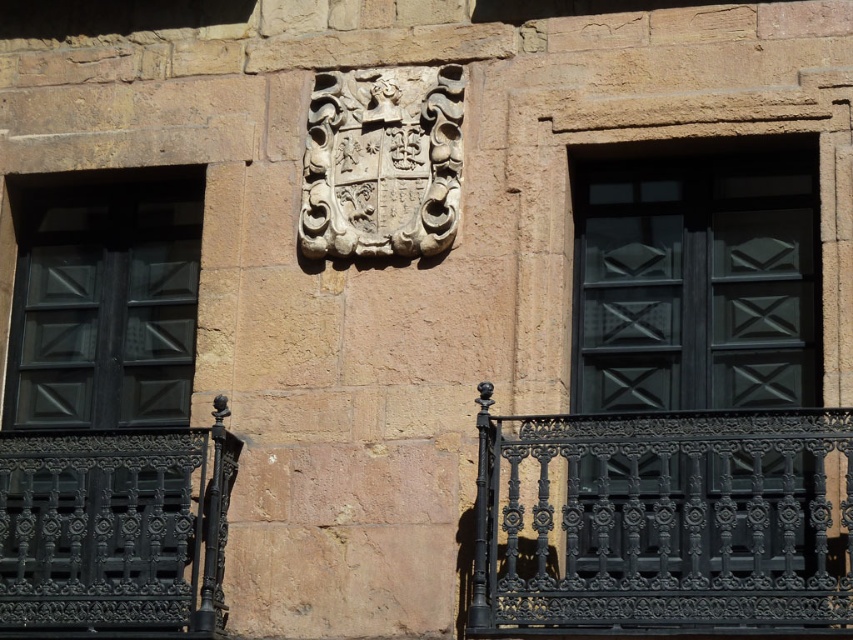
Question: Can you confirm if matte black window at right is smaller than white stone coat of arms at center?

Choices:
 (A) no
 (B) yes

Answer: (A)

Question: Which of the following is the farthest from the observer?

Choices:
 (A) matte black window at right
 (B) black wrought iron balustrade at lower right
 (C) black wrought iron balustrade at lower left
 (D) white stone coat of arms at center

Answer: (D)

Question: Does black wrought iron balustrade at lower left appear over white stone coat of arms at center?

Choices:
 (A) no
 (B) yes

Answer: (A)

Question: From the image, what is the correct spatial relationship of black wrought iron balustrade at lower right in relation to matte black wood at left?

Choices:
 (A) right
 (B) left

Answer: (A)

Question: Which object appears closest to the camera in this image?

Choices:
 (A) black wrought iron balustrade at lower left
 (B) matte black window at right
 (C) matte black wood at left
 (D) black wrought iron balustrade at lower right

Answer: (D)

Question: Among these objects, which one is nearest to the camera?

Choices:
 (A) matte black window at right
 (B) black wrought iron balustrade at lower right
 (C) white stone coat of arms at center

Answer: (B)